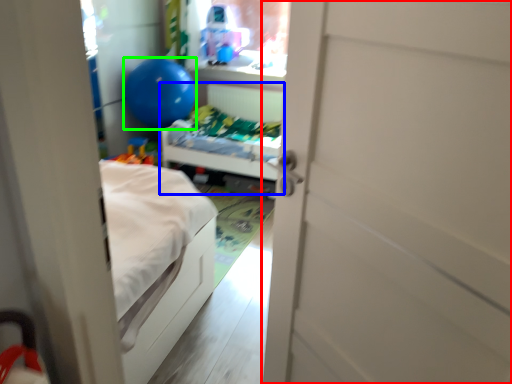
Question: Which is nearer to the door (highlighted by a red box)? hospital bed (highlighted by a blue box) or balloon (highlighted by a green box).

Choices:
 (A) hospital bed
 (B) balloon

Answer: (A)